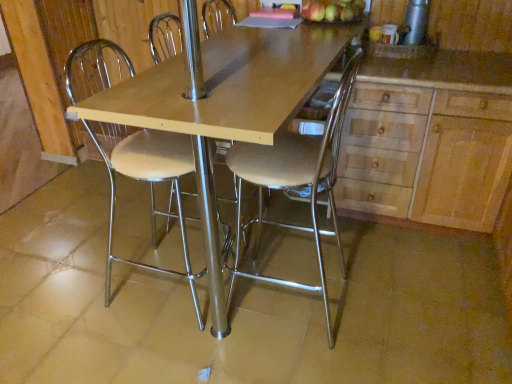
Question: Can you confirm if wooden table at center is positioned to the right of wooden cabinet at right?

Choices:
 (A) no
 (B) yes

Answer: (A)

Question: Is the position of wooden table at center less distant than that of wooden cabinet at right?

Choices:
 (A) no
 (B) yes

Answer: (B)

Question: Is wooden table at center taller than wooden cabinet at right?

Choices:
 (A) yes
 (B) no

Answer: (A)

Question: Can you confirm if wooden table at center is smaller than wooden cabinet at right?

Choices:
 (A) yes
 (B) no

Answer: (B)

Question: From a real-world perspective, is wooden table at center over wooden cabinet at right?

Choices:
 (A) yes
 (B) no

Answer: (A)

Question: Is green matte apples at upper right inside the boundaries of metallic silver stool at center, the first chair in the left-to-right sequence, or outside?

Choices:
 (A) outside
 (B) inside

Answer: (A)

Question: Considering the positions of green matte apples at upper right and metallic silver stool at center, which is the second chair in right-to-left order, in the image, is green matte apples at upper right bigger or smaller than metallic silver stool at center, which is the second chair in right-to-left order,?

Choices:
 (A) big
 (B) small

Answer: (B)

Question: From the image's perspective, is green matte apples at upper right above or below metallic silver stool at center, the first chair in the left-to-right sequence?

Choices:
 (A) below
 (B) above

Answer: (B)

Question: From a real-world perspective, relative to metallic silver stool at center, which is the second chair in right-to-left order, is green matte apples at upper right vertically above or below?

Choices:
 (A) above
 (B) below

Answer: (A)

Question: From the image's perspective, relative to wooden cabinet at right, is wooden table at center above or below?

Choices:
 (A) below
 (B) above

Answer: (A)

Question: Is wooden table at center in front of or behind wooden cabinet at right in the image?

Choices:
 (A) front
 (B) behind

Answer: (A)

Question: Considering the positions of wooden table at center and wooden cabinet at right in the image, is wooden table at center taller or shorter than wooden cabinet at right?

Choices:
 (A) tall
 (B) short

Answer: (A)

Question: Does point (288, 36) appear closer or farther from the camera than point (437, 182)?

Choices:
 (A) closer
 (B) farther

Answer: (A)

Question: Considering their positions, is wooden cabinet at right located in front of or behind silver metallic thermos at upper right?

Choices:
 (A) behind
 (B) front

Answer: (B)

Question: From the image's perspective, is wooden cabinet at right positioned above or below silver metallic thermos at upper right?

Choices:
 (A) above
 (B) below

Answer: (B)